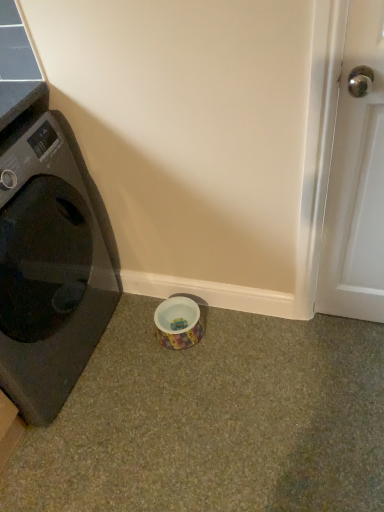
Question: Is black glossy washing machine at left further to the viewer compared to white glossy door handle at right?

Choices:
 (A) yes
 (B) no

Answer: (A)

Question: Does black glossy washing machine at left have a lesser width compared to white glossy door handle at right?

Choices:
 (A) no
 (B) yes

Answer: (A)

Question: Is black glossy washing machine at left not within white glossy door handle at right?

Choices:
 (A) yes
 (B) no

Answer: (A)

Question: Is white glossy door handle at right located within black glossy washing machine at left?

Choices:
 (A) no
 (B) yes

Answer: (A)

Question: From the image's perspective, is black glossy washing machine at left under white glossy door handle at right?

Choices:
 (A) yes
 (B) no

Answer: (A)

Question: Is black glossy washing machine at left wider than white glossy door handle at right?

Choices:
 (A) yes
 (B) no

Answer: (A)

Question: From the image's perspective, is black glossy washing machine at left under multicolored ceramic bowl at lower center?

Choices:
 (A) yes
 (B) no

Answer: (B)

Question: From a real-world perspective, is black glossy washing machine at left on top of multicolored ceramic bowl at lower center?

Choices:
 (A) yes
 (B) no

Answer: (A)

Question: Could you tell me if black glossy washing machine at left is turned towards multicolored ceramic bowl at lower center?

Choices:
 (A) yes
 (B) no

Answer: (A)

Question: Is black glossy washing machine at left at the left side of multicolored ceramic bowl at lower center?

Choices:
 (A) no
 (B) yes

Answer: (B)

Question: Does black glossy washing machine at left have a greater width compared to multicolored ceramic bowl at lower center?

Choices:
 (A) yes
 (B) no

Answer: (A)

Question: Does black glossy washing machine at left have a larger size compared to multicolored ceramic bowl at lower center?

Choices:
 (A) no
 (B) yes

Answer: (B)

Question: Is white glossy door handle at right closer to the viewer compared to black glossy washing machine at left?

Choices:
 (A) yes
 (B) no

Answer: (A)